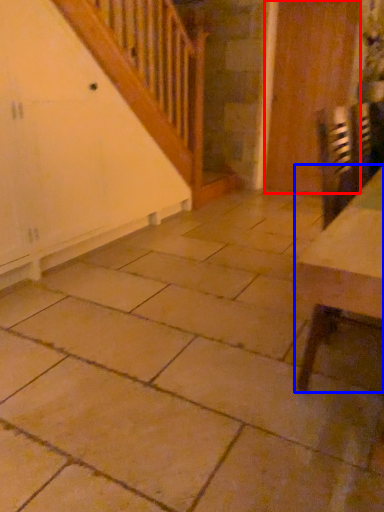
Question: Which point is further to the camera, door (highlighted by a red box) or table (highlighted by a blue box)?

Choices:
 (A) door
 (B) table

Answer: (A)